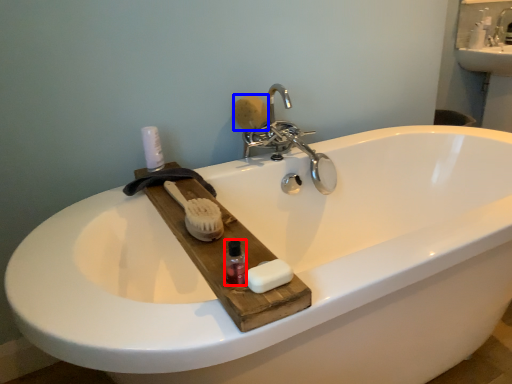
Question: Which of the following is the farthest to the observer, mouthwash (highlighted by a red box) or soap (highlighted by a blue box)?

Choices:
 (A) mouthwash
 (B) soap

Answer: (B)